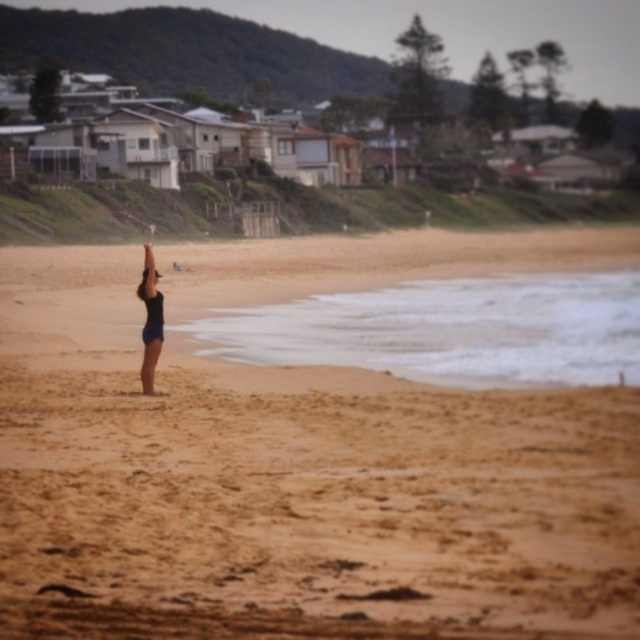
Question: Among these points, which one is nearest to the camera?

Choices:
 (A) (150, 280)
 (B) (150, 428)

Answer: (B)

Question: Can you confirm if brown sandy beach at center is positioned above black matte swimsuit at center?

Choices:
 (A) yes
 (B) no

Answer: (B)

Question: Can you confirm if brown sandy beach at center is positioned below black matte swimsuit at center?

Choices:
 (A) no
 (B) yes

Answer: (B)

Question: Which of the following is the farthest from the observer?

Choices:
 (A) brown sandy beach at center
 (B) black matte swimsuit at center

Answer: (B)

Question: Which object is farther from the camera taking this photo?

Choices:
 (A) brown sandy beach at center
 (B) black matte swimsuit at center

Answer: (B)

Question: Is brown sandy beach at center wider than black matte swimsuit at center?

Choices:
 (A) no
 (B) yes

Answer: (B)